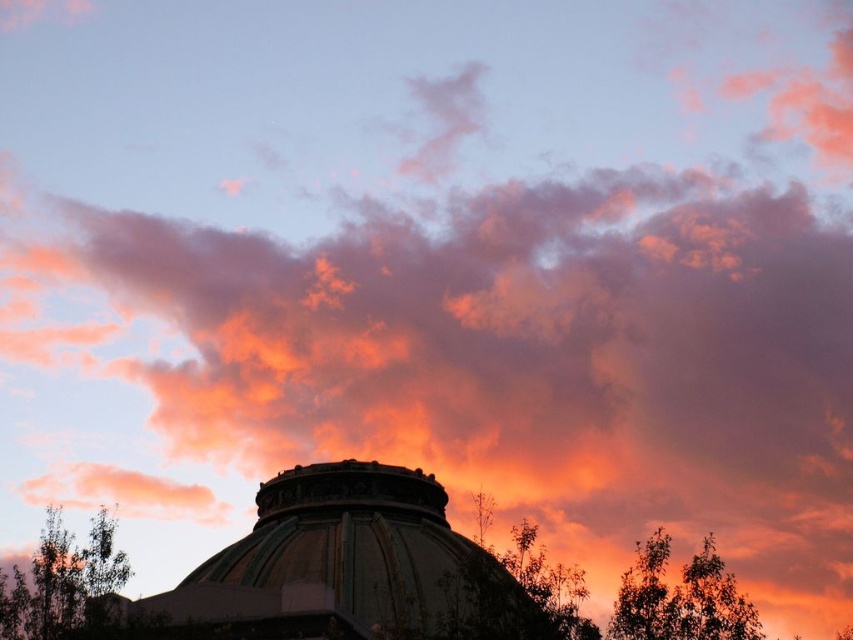
You are an architect analyzing the scene. The metallic dome at center and the green leafy tree at lower left are both in your view. Which object appears larger in the image?

The green leafy tree at lower left appears larger than the metallic dome at center according to the description.

You are standing in the scene and want to take a photo of the sunset with both the green leafy tree at lower left and the green leafy tree at right in the frame. Which tree should you position closer to the camera to ensure both are visible without overlapping?

You should position the green leafy tree at lower left closer to the camera since it is already in front of the green leafy tree at right, allowing both to be visible without overlapping.